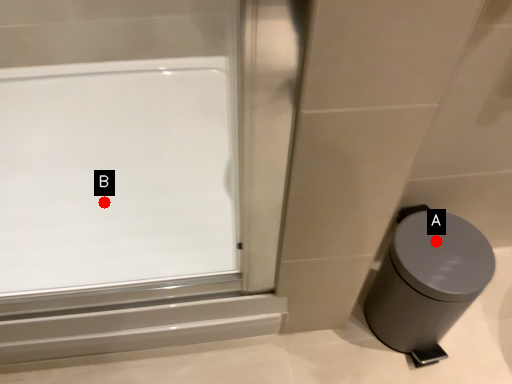
Question: Two points are circled on the image, labeled by A and B beside each circle. Which of the following is the closest to the observer?

Choices:
 (A) A is closer
 (B) B is closer

Answer: (A)